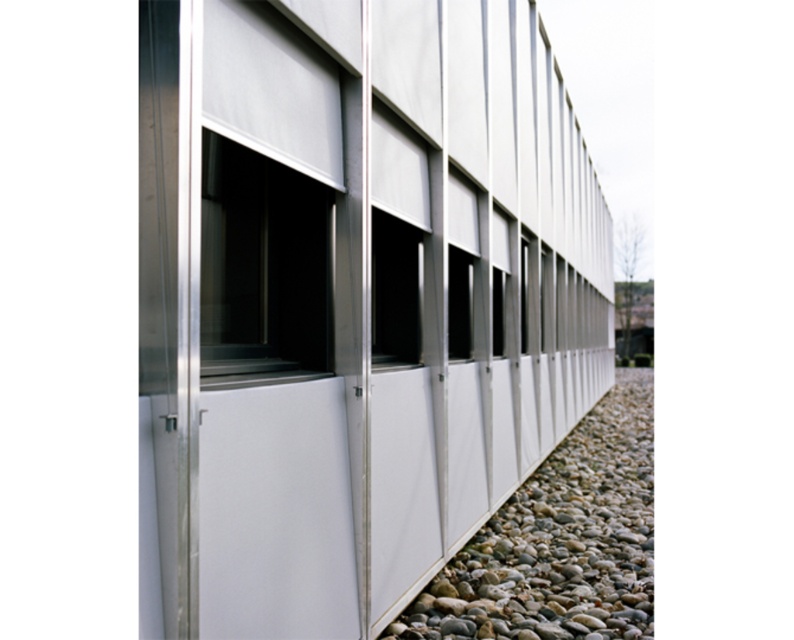
Can you confirm if matte silver window at center is shorter than matte glass window at center?

No.

Does point (256, 275) lie in front of point (407, 237)?

Yes, point (256, 275) is in front of point (407, 237).

Does point (328, 349) come closer to viewer compared to point (380, 346)?

Yes.

At what (x,y) coordinates should I click in order to perform the action: click on matte silver window at center. Please return your answer as a coordinate pair (x, y). This screenshot has height=640, width=794. Looking at the image, I should click on (261, 266).

Who is positioned more to the left, matte glass window at center or transparent glass window at center?

matte glass window at center is more to the left.

Between point (388, 316) and point (453, 296), which one is positioned in front?

Point (388, 316)

Image resolution: width=794 pixels, height=640 pixels. Describe the element at coordinates (395, 291) in the screenshot. I see `matte glass window at center` at that location.

Locate an element on the screen. matte glass window at center is located at coordinates (395, 291).

Based on the photo, is matte silver window at center thinner than transparent glass window at center?

No.

At what (x,y) coordinates should I click in order to perform the action: click on matte silver window at center. Please return your answer as a coordinate pair (x, y). Looking at the image, I should click on (261, 266).